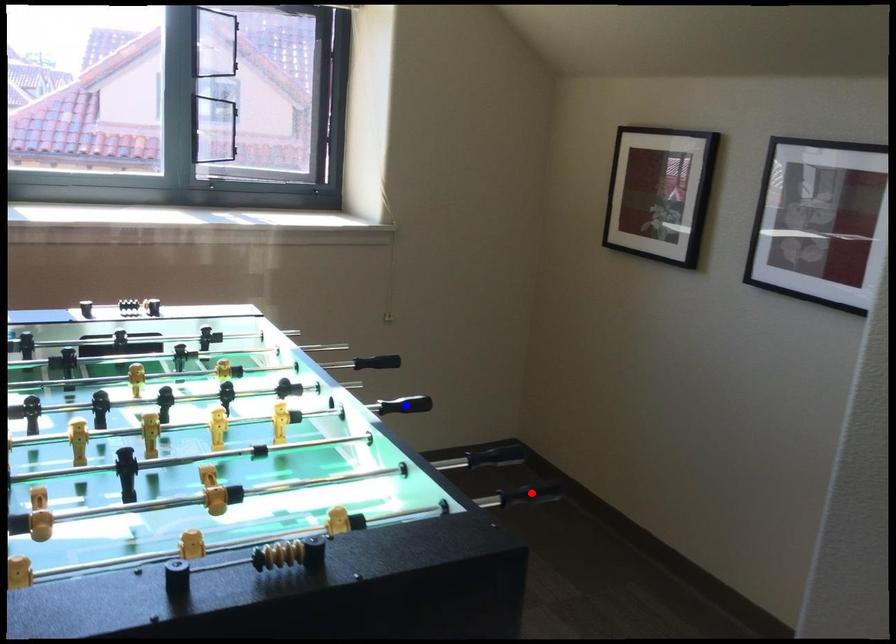
Question: Two points are marked on the image. Which point is closer to the camera?

Choices:
 (A) Blue point is closer.
 (B) Red point is closer.

Answer: (B)